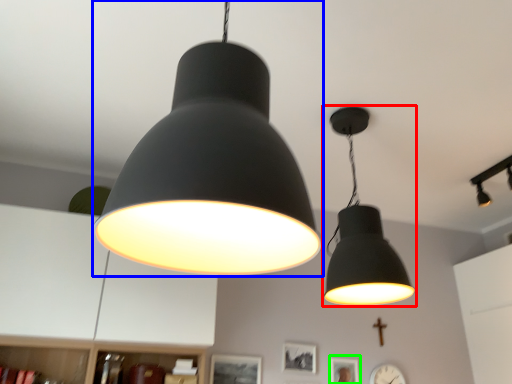
Question: Which object is positioned closest to lamp (highlighted by a red box)? Select from lamp (highlighted by a blue box) and picture frame (highlighted by a green box).

Choices:
 (A) lamp
 (B) picture frame

Answer: (A)